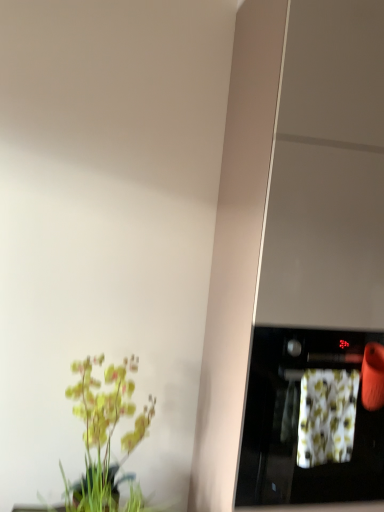
The width and height of the screenshot is (384, 512). What do you see at coordinates (104, 432) in the screenshot?
I see `green matte plant at lower left` at bounding box center [104, 432].

Find the location of a particular element. green matte plant at lower left is located at coordinates (104, 432).

Considering the positions of points (144, 418) and (271, 328), is point (144, 418) closer to camera compared to point (271, 328)?

That is False.

Is green matte plant at lower left looking in the opposite direction of black glossy oven at right?

green matte plant at lower left is not turned away from black glossy oven at right.

Which object is thinner, green matte plant at lower left or black glossy oven at right?

Thinner between the two is green matte plant at lower left.

Identify the location of flower behind the black glossy oven at right. (327, 416).

Is floral fabric at right at the back of black glossy oven at right?

Yes, black glossy oven at right is positioned with its back facing floral fabric at right.

How different are the orientations of black glossy oven at right and floral fabric at right in degrees?

They differ by 0.000838 degrees in their facing directions.

Who is more distant, black glossy oven at right or floral fabric at right?

floral fabric at right is further from the camera.

Does point (306, 368) lie in front of point (102, 486)?

Yes, point (306, 368) is closer to viewer.

From the image's perspective, which one is positioned lower, black glossy oven at right or green matte plant at lower left?

green matte plant at lower left.

Which of these two, black glossy oven at right or green matte plant at lower left, stands shorter?

black glossy oven at right.

This screenshot has width=384, height=512. I want to click on appliance above the green matte plant at lower left (from the image's perspective), so click(298, 422).

From the image's perspective, which object appears higher, green matte plant at lower left or floral fabric at right?

floral fabric at right.

Who is shorter, green matte plant at lower left or floral fabric at right?

floral fabric at right is shorter.

How many degrees apart are the facing directions of green matte plant at lower left and floral fabric at right?

There is a 0.475-degree angle between the facing directions of green matte plant at lower left and floral fabric at right.

Is point (140, 428) positioned behind point (348, 399)?

That is True.

From the image's perspective, which is above, floral fabric at right or black glossy oven at right?

floral fabric at right appears higher in the image.

Is floral fabric at right shorter than black glossy oven at right?

Indeed, floral fabric at right has a lesser height compared to black glossy oven at right.

Would you say floral fabric at right is outside black glossy oven at right?

No, floral fabric at right is not outside of black glossy oven at right.

Is floral fabric at right looking in the opposite direction of black glossy oven at right?

Yes, floral fabric at right's orientation is away from black glossy oven at right.

Identify the location of houseplant behind the floral fabric at right. (104, 432).

Based on the photo, from a real-world perspective, between floral fabric at right and green matte plant at lower left, who is vertically higher?

floral fabric at right, from a real-world perspective.

Based on the photo, is the position of floral fabric at right less distant than that of green matte plant at lower left?

Yes, the depth of floral fabric at right is less than that of green matte plant at lower left.

Is floral fabric at right outside of green matte plant at lower left?

Yes, floral fabric at right is outside of green matte plant at lower left.

I want to click on houseplant that appears below the black glossy oven at right (from the image's perspective), so click(x=104, y=432).

Where is `flower lying on the right of black glossy oven at right`? The width and height of the screenshot is (384, 512). flower lying on the right of black glossy oven at right is located at coordinates (327, 416).

In the scene shown: Estimate the real-world distances between objects in this image. Which object is further from floral fabric at right, green matte plant at lower left or black glossy oven at right?

green matte plant at lower left is further to floral fabric at right.

When comparing their distances from green matte plant at lower left, does floral fabric at right or black glossy oven at right seem further?

Based on the image, floral fabric at right appears to be further to green matte plant at lower left.

From the picture: Which object lies further to the anchor point black glossy oven at right, floral fabric at right or green matte plant at lower left?

Based on the image, green matte plant at lower left appears to be further to black glossy oven at right.

Which object lies further to the anchor point floral fabric at right, black glossy oven at right or green matte plant at lower left?

green matte plant at lower left is positioned further to the anchor floral fabric at right.

Considering their positions, is black glossy oven at right positioned closer to green matte plant at lower left than floral fabric at right?

Based on the image, black glossy oven at right appears to be nearer to green matte plant at lower left.

When comparing their distances from black glossy oven at right, does green matte plant at lower left or floral fabric at right seem further?

Based on the image, green matte plant at lower left appears to be further to black glossy oven at right.

The image size is (384, 512). I want to click on appliance between green matte plant at lower left and floral fabric at right in the horizontal direction, so click(x=298, y=422).